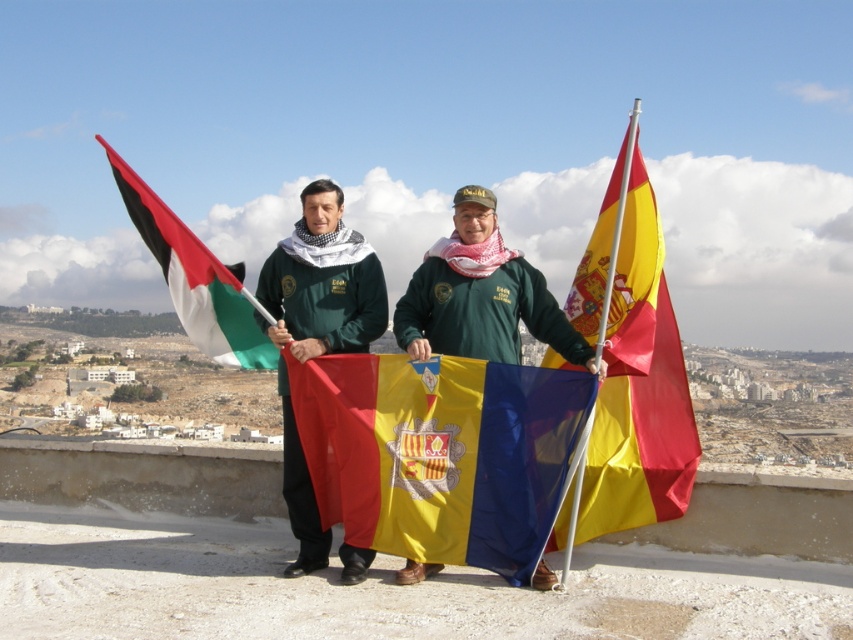
Question: Which point is closer to the camera?

Choices:
 (A) polyester flag at center
 (B) matte green sweatshirt at center
 (C) green matte jacket at center
 (D) black and white striped flag at left

Answer: (B)

Question: Which point is farther to the camera?

Choices:
 (A) yellow/red striped flag at right
 (B) matte green sweatshirt at center
 (C) black and white striped flag at left
 (D) green matte jacket at center

Answer: (C)

Question: Where is yellow/red striped flag at right located in relation to black and white striped flag at left in the image?

Choices:
 (A) right
 (B) left

Answer: (A)

Question: Is yellow/red striped flag at right bigger than green matte jacket at center?

Choices:
 (A) no
 (B) yes

Answer: (A)

Question: Can you confirm if yellow/red striped flag at right is positioned above black and white striped flag at left?

Choices:
 (A) yes
 (B) no

Answer: (B)

Question: Which object is positioned closest to the green matte jacket at center?

Choices:
 (A) polyester flag at center
 (B) yellow/red striped flag at right
 (C) matte green sweatshirt at center

Answer: (C)